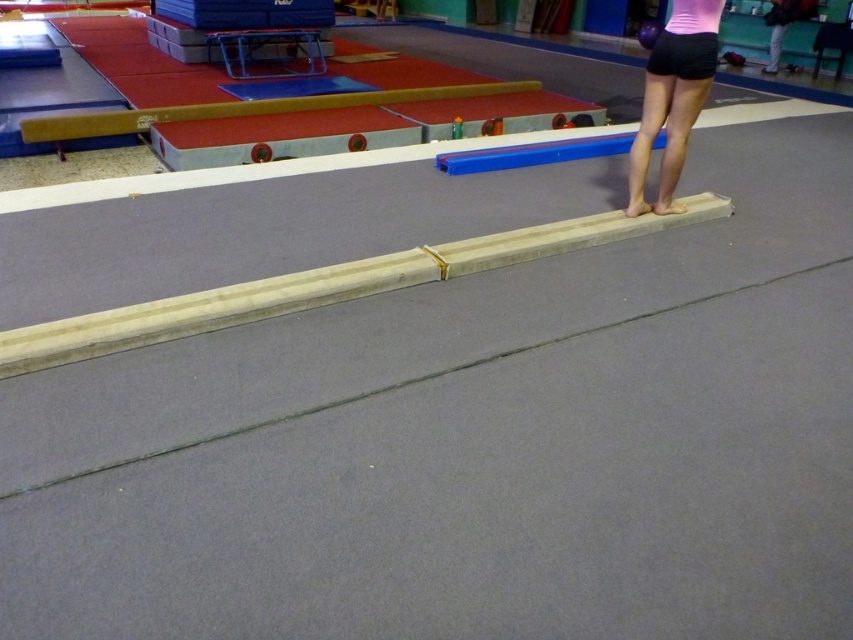
Question: Which point appears closest to the camera in this image?

Choices:
 (A) (207, 108)
 (B) (427, 257)
 (C) (680, 33)

Answer: (B)

Question: Which point is farther to the camera?

Choices:
 (A) wooden gymnastics beam at upper center
 (B) black fabric shorts at upper right
 (C) black matte shorts at right
 (D) smooth wood beam at center

Answer: (A)

Question: Does black matte shorts at right appear over wooden gymnastics beam at upper center?

Choices:
 (A) no
 (B) yes

Answer: (A)

Question: Can you confirm if black matte shorts at right is wider than wooden gymnastics beam at upper center?

Choices:
 (A) no
 (B) yes

Answer: (A)

Question: Is black matte shorts at right closer to the viewer compared to black fabric shorts at upper right?

Choices:
 (A) no
 (B) yes

Answer: (B)

Question: Among these points, which one is farthest from the camera?

Choices:
 (A) (212, 310)
 (B) (677, 72)

Answer: (B)